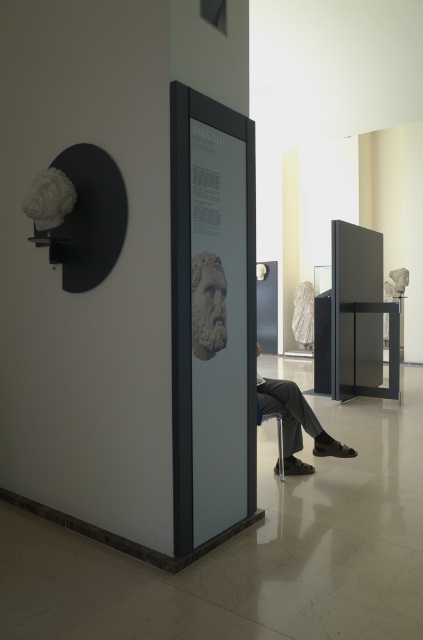
Which is below, dark gray fabric pants at lower center or white marble bust at center?

Positioned lower is dark gray fabric pants at lower center.

You are a GUI agent. You are given a task and a screenshot of the screen. Output one action in this format:
    pyautogui.click(x=<x>, y=<y>)
    Task: Click on the dark gray fabric pants at lower center
    Image resolution: width=423 pixels, height=640 pixels.
    Given the screenshot: What is the action you would take?
    pyautogui.click(x=296, y=422)

Is white marble bust at center wider than metallic silver chair at lower center?

No, white marble bust at center is not wider than metallic silver chair at lower center.

Is point (192, 268) in front of point (280, 476)?

Yes, point (192, 268) is in front of point (280, 476).

Find the location of a particular element. This screenshot has height=640, width=423. white marble bust at center is located at coordinates (208, 305).

Where is `white marble bust at center`? This screenshot has width=423, height=640. white marble bust at center is located at coordinates (208, 305).

Can you confirm if dark gray fabric pants at lower center is positioned to the right of metallic silver chair at lower center?

Yes, dark gray fabric pants at lower center is to the right of metallic silver chair at lower center.

Consider the image. Can you confirm if dark gray fabric pants at lower center is thinner than metallic silver chair at lower center?

No.

The image size is (423, 640). I want to click on dark gray fabric pants at lower center, so click(296, 422).

Image resolution: width=423 pixels, height=640 pixels. Find the location of `dark gray fabric pants at lower center`. dark gray fabric pants at lower center is located at coordinates (296, 422).